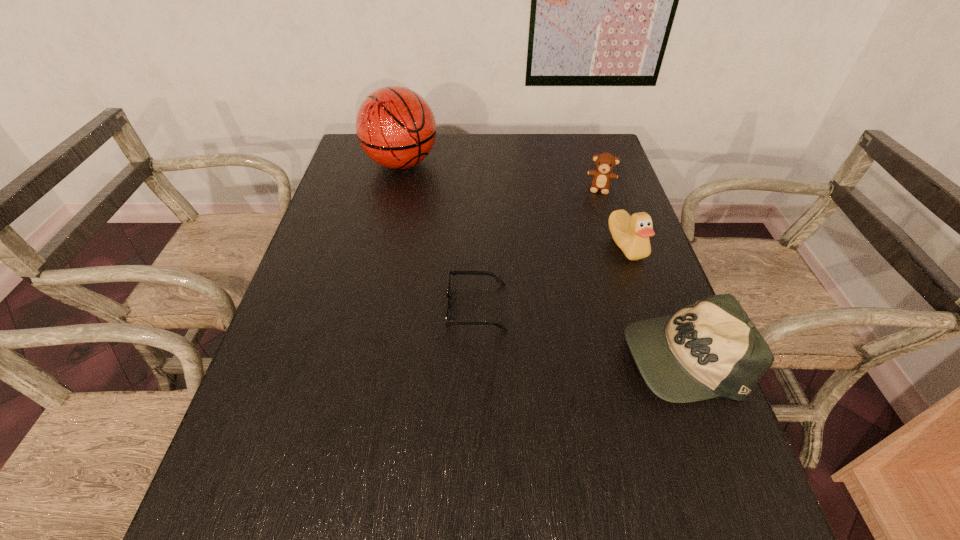
Identify which object is located as the nearest to the second object from left to right. Please provide its 2D coordinates. Your answer should be formatted as a tuple, i.e. [(x, y)], where the tuple contains the x and y coordinates of a point satisfying the conditions above.

[(711, 348)]

Find the location of a particular element. free space that satisfies the following two spatial constraints: 1. on the front side of the third nearest object; 2. on the right side of the tallest object is located at coordinates (383, 246).

Find the location of a particular element. The image size is (960, 540). vacant space that satisfies the following two spatial constraints: 1. on the front side of the shortest object; 2. on the front-facing side of the leftmost object is located at coordinates (369, 307).

The height and width of the screenshot is (540, 960). Find the location of `free region that satisfies the following two spatial constraints: 1. on the front side of the teddy bear; 2. on the left side of the third nearest object`. free region that satisfies the following two spatial constraints: 1. on the front side of the teddy bear; 2. on the left side of the third nearest object is located at coordinates pos(620,246).